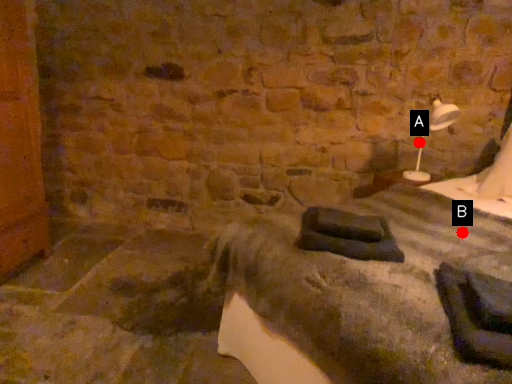
Question: Two points are circled on the image, labeled by A and B beside each circle. Among these points, which one is nearest to the camera?

Choices:
 (A) A is closer
 (B) B is closer

Answer: (B)